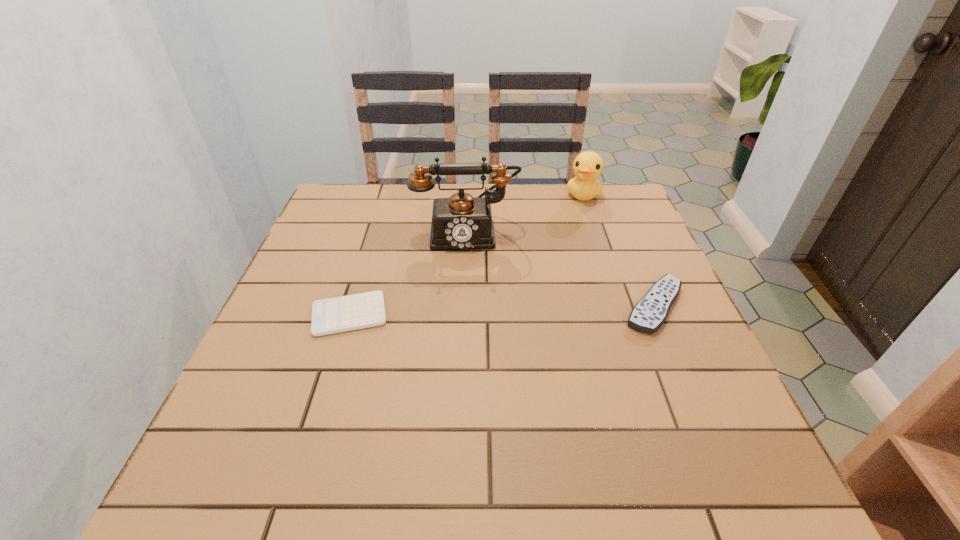
You are a GUI agent. You are given a task and a screenshot of the screen. Output one action in this format:
    pyautogui.click(x=<x>, y=<y>)
    Task: Click on the free space located 0.340m on the front of the second farthest object at the rotary dial
    The width and height of the screenshot is (960, 540).
    Given the screenshot: What is the action you would take?
    pyautogui.click(x=469, y=355)

Identify the location of free region located 0.050m on the front of the second farthest object at the rotary dial. (468, 265).

You are a GUI agent. You are given a task and a screenshot of the screen. Output one action in this format:
    pyautogui.click(x=<x>, y=<y>)
    Task: Click on the vacant point located on the face of the farthest object
    The width and height of the screenshot is (960, 540).
    Given the screenshot: What is the action you would take?
    pyautogui.click(x=569, y=246)

Find the location of a particular element. This screenshot has height=540, width=960. free space located 0.330m on the face of the farthest object is located at coordinates (561, 274).

The width and height of the screenshot is (960, 540). Identify the location of free space located on the face of the farthest object. (579, 214).

You are a GUI agent. You are given a task and a screenshot of the screen. Output one action in this format:
    pyautogui.click(x=<x>, y=<y>)
    Task: Click on the telephone present at the far edge
    
    Given the screenshot: What is the action you would take?
    pyautogui.click(x=461, y=222)

Identify the location of duck at the far edge. (587, 166).

In order to click on object that is at the left edge in this screenshot , I will do `click(333, 315)`.

You are a GUI agent. You are given a task and a screenshot of the screen. Output one action in this format:
    pyautogui.click(x=<x>, y=<y>)
    Task: Click on the remote control positioned at the right edge
    Image resolution: width=960 pixels, height=540 pixels.
    Given the screenshot: What is the action you would take?
    pyautogui.click(x=648, y=315)

Find the location of a particular element. This screenshot has height=540, width=960. duck located at the right edge is located at coordinates (587, 166).